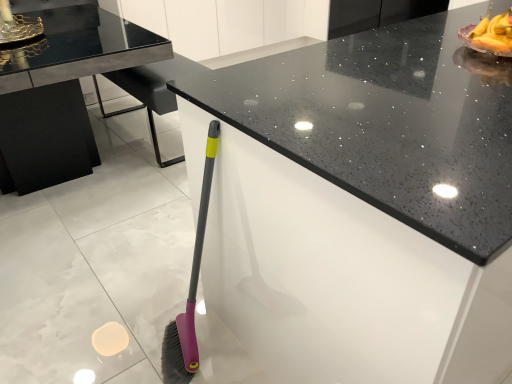
The height and width of the screenshot is (384, 512). What do you see at coordinates (388, 123) in the screenshot?
I see `black speckled granite countertop at center` at bounding box center [388, 123].

Measure the distance between black speckled granite countertop at center and camera.

black speckled granite countertop at center and camera are 23.61 inches apart from each other.

This screenshot has width=512, height=384. I want to click on black speckled granite countertop at center, so click(x=388, y=123).

Identify the location of black glass table at upper left. This screenshot has width=512, height=384. (62, 92).

This screenshot has width=512, height=384. What do you see at coordinates (62, 92) in the screenshot?
I see `black glass table at upper left` at bounding box center [62, 92].

Where is `black speckled granite countertop at center`? black speckled granite countertop at center is located at coordinates click(x=388, y=123).

Considering the positions of objects black glass table at upper left and black speckled granite countertop at center in the image provided, who is more to the left, black glass table at upper left or black speckled granite countertop at center?

Positioned to the left is black glass table at upper left.

Does black glass table at upper left lie in front of black speckled granite countertop at center?

No, black glass table at upper left is further to the viewer.

Is point (14, 94) in front of point (303, 73)?

No, (14, 94) is behind (303, 73).

From the image's perspective, which object appears higher, black glass table at upper left or black speckled granite countertop at center?

black glass table at upper left is shown above in the image.

From a real-world perspective, is black glass table at upper left located higher than black speckled granite countertop at center?

No, from a real-world perspective, black glass table at upper left is not on top of black speckled granite countertop at center.

Considering the sizes of objects black glass table at upper left and black speckled granite countertop at center in the image provided, who is thinner, black glass table at upper left or black speckled granite countertop at center?

black speckled granite countertop at center.

Between black glass table at upper left and black speckled granite countertop at center, which one has less height?

Standing shorter between the two is black glass table at upper left.

Between black glass table at upper left and black speckled granite countertop at center, which one has larger size?

Bigger between the two is black speckled granite countertop at center.

Based on the photo, could black speckled granite countertop at center be considered to be inside black glass table at upper left?

No, black glass table at upper left does not contain black speckled granite countertop at center.

From the picture: Is black glass table at upper left next to black speckled granite countertop at center?

No, black glass table at upper left is not touching black speckled granite countertop at center.

Is black glass table at upper left oriented towards black speckled granite countertop at center?

No.

Where is `countertop above the black glass table at upper left (from a real-world perspective)`? countertop above the black glass table at upper left (from a real-world perspective) is located at coordinates (388, 123).

Does black speckled granite countertop at center appear on the right side of black glass table at upper left?

Yes.

Consider the image. Which object is closer to the camera taking this photo, black speckled granite countertop at center or black glass table at upper left?

black speckled granite countertop at center is closer to the camera.

Which is closer to the camera, (496, 204) or (93, 73)?

Clearly, point (496, 204) is closer to the camera than point (93, 73).

From the image's perspective, does black speckled granite countertop at center appear lower than black glass table at upper left?

Correct, black speckled granite countertop at center appears lower than black glass table at upper left in the image.

From a real-world perspective, which object rests below the other?

black glass table at upper left.

Is black speckled granite countertop at center thinner than black glass table at upper left?

Correct, the width of black speckled granite countertop at center is less than that of black glass table at upper left.

Is black speckled granite countertop at center taller than black glass table at upper left?

Yes.

Based on their sizes in the image, would you say black speckled granite countertop at center is bigger or smaller than black glass table at upper left?

In the image, black speckled granite countertop at center appears to be larger than black glass table at upper left.

Consider the image. Is black speckled granite countertop at center positioned beyond the bounds of black glass table at upper left?

black speckled granite countertop at center is positioned outside black glass table at upper left.

Would you consider black speckled granite countertop at center to be distant from black glass table at upper left?

Yes, black speckled granite countertop at center is far from black glass table at upper left.

Is black speckled granite countertop at center oriented towards black glass table at upper left?

Yes, black speckled granite countertop at center is oriented towards black glass table at upper left.

This screenshot has width=512, height=384. Find the location of `countertop to the right of black glass table at upper left`. countertop to the right of black glass table at upper left is located at coordinates (388, 123).

Locate an element on the screen. Image resolution: width=512 pixels, height=384 pixels. countertop lying in front of the black glass table at upper left is located at coordinates (388, 123).

The image size is (512, 384). Identify the location of table that appears above the black speckled granite countertop at center (from the image's perspective). (62, 92).